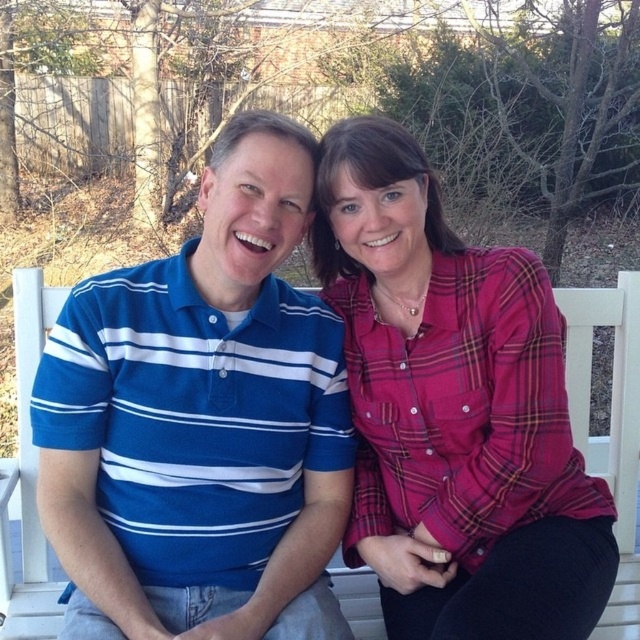
Question: Among these points, which one is farthest from the camera?

Choices:
 (A) (291, 584)
 (B) (346, 211)

Answer: (B)

Question: Where is blue striped polo shirt at left located in relation to plaid fabric shirt at center in the image?

Choices:
 (A) above
 (B) below

Answer: (A)

Question: Where is blue striped polo shirt at left located in relation to plaid fabric shirt at center in the image?

Choices:
 (A) right
 (B) left

Answer: (B)

Question: Which of the following is the farthest from the observer?

Choices:
 (A) plaid fabric shirt at center
 (B) blue striped polo shirt at left

Answer: (B)

Question: Where is blue striped polo shirt at left located in relation to plaid fabric shirt at center in the image?

Choices:
 (A) left
 (B) right

Answer: (A)